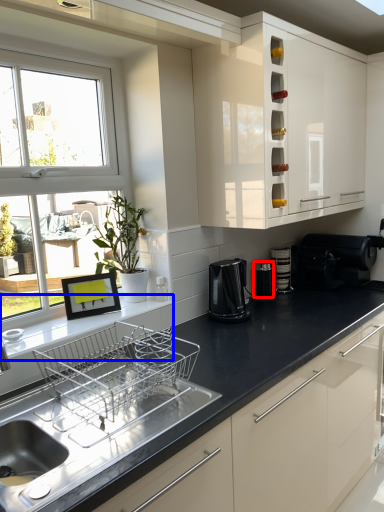
Question: Which object is further to the camera taking this photo, appliance (highlighted by a red box) or window sill (highlighted by a blue box)?

Choices:
 (A) appliance
 (B) window sill

Answer: (A)